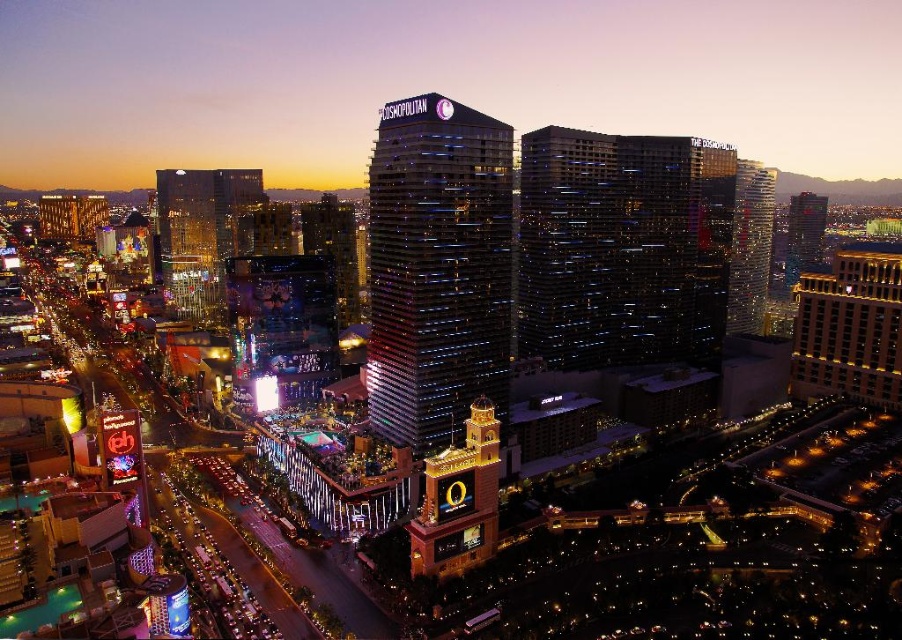
Looking at this image, you are standing at the center of the city and want to locate the shiny glass skyscraper at center. What are the coordinates where you can find it?

The shiny glass skyscraper at center can be found at coordinates point (437, 268).

You are a drone operator tasked with flying a drone between the reflective glass skyscraper at center and the metallic glass skyscraper at upper right. The drone has a wingspan of 10 feet. Can the drone safely navigate the space between them without colliding?

The reflective glass skyscraper at center is 101.30 feet from the metallic glass skyscraper at upper right. Since the drone has a wingspan of 10 feet, there is ample space for it to navigate safely between them without collision.